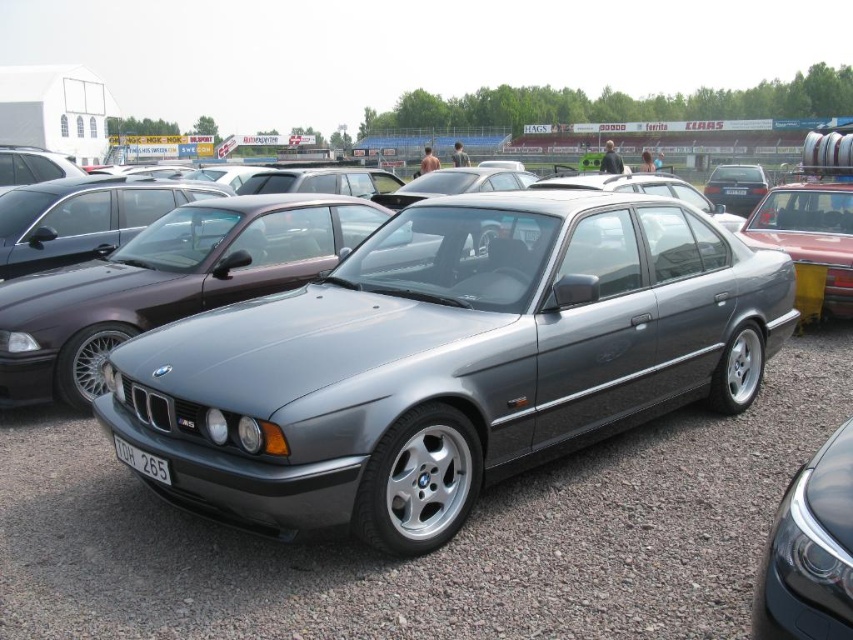
You are a parking attendant at the car show and need to fit both the metallic silver sedan at right and the satin black sedan at upper right into a narrow parking space. Which car should you choose to fit first to ensure both can fit?

The metallic silver sedan at right is thinner than the satin black sedan at upper right, so you should fit the metallic silver sedan at right first to ensure both can fit in the narrow space.

You are standing at the entrance of the car show and want to take a photo of both the metallic silver sedan at right and the satin black sedan at upper right. Can you fit both cars in your camera frame if your camera can capture a maximum distance of 10 meters between subjects?

The metallic silver sedan at right is 11.51 meters away from the satin black sedan at upper right. Since the camera can only capture up to 10 meters between subjects, the distance between them exceeds the camera frame capacity. Therefore, you cannot fit both cars in the photo.

You are standing at the point closest to the front of the scene. There are two points marked in the image, one at point (804, 193) and another at point (132, 456). Which of these points is farther away from you?

Point (804, 193) is behind point (132, 456), so the point at (804, 193) is farther away from you.